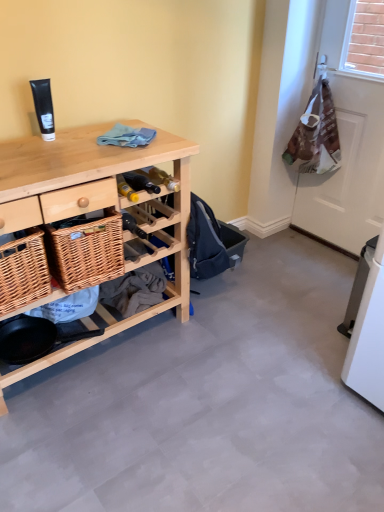
Question: In terms of width, does natural wood desk at left look wider or thinner when compared to black matte tube at upper left?

Choices:
 (A) thin
 (B) wide

Answer: (B)

Question: Looking at the image, does natural wood desk at left seem bigger or smaller compared to black matte tube at upper left?

Choices:
 (A) big
 (B) small

Answer: (A)

Question: Which object is positioned closest to the blue cotton cloth at center?

Choices:
 (A) black matte tube at upper left
 (B) natural wood desk at left
 (C) brown paper bag at right
 (D) woven brown picnic basket at lower left

Answer: (A)

Question: Which is nearer to the black matte tube at upper left?

Choices:
 (A) natural wood desk at left
 (B) brown paper bag at right
 (C) blue cotton cloth at center
 (D) woven brown picnic basket at lower left

Answer: (C)